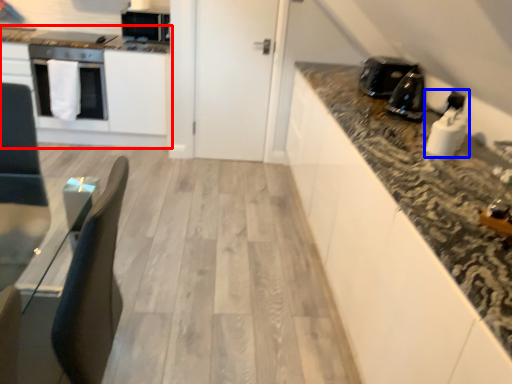
Question: Which object appears farthest to the camera in this image, cabinetry (highlighted by a red box) or appliance (highlighted by a blue box)?

Choices:
 (A) cabinetry
 (B) appliance

Answer: (A)